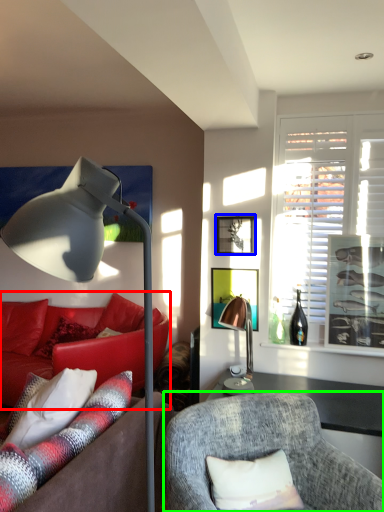
Question: Considering the real-world distances, which object is farthest from studio couch (highlighted by a red box)? picture frame (highlighted by a blue box) or chair (highlighted by a green box)?

Choices:
 (A) picture frame
 (B) chair

Answer: (B)